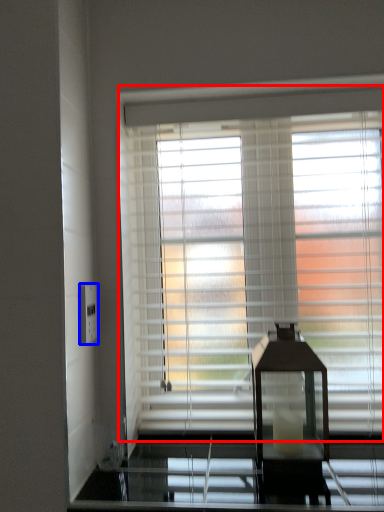
Question: Among these objects, which one is farthest to the camera, window blind (highlighted by a red box) or electric outlet (highlighted by a blue box)?

Choices:
 (A) window blind
 (B) electric outlet

Answer: (A)